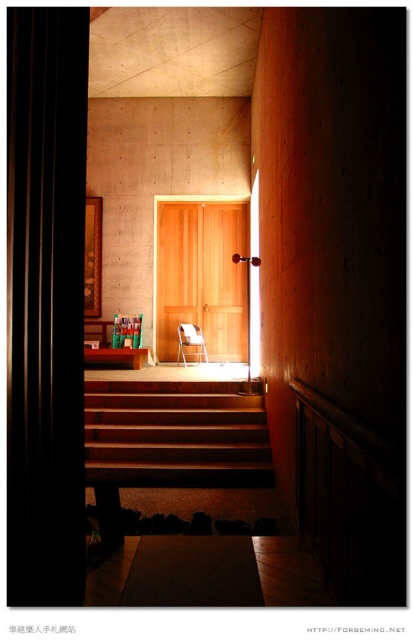
You are a delivery person carrying a package that is 1.2 meters wide. You need to place it in the corridor where there is a wooden at center and a matte wood chair at center. Can you fit the package between them?

The wooden at center is wider than the matte wood chair at center. Since the package is 1.2 meters wide, you need to check the space between them. However, without knowing the exact distance between the two objects, it is impossible to determine if the package will fit. Please measure the space between the wooden at center and the matte wood chair at center first.